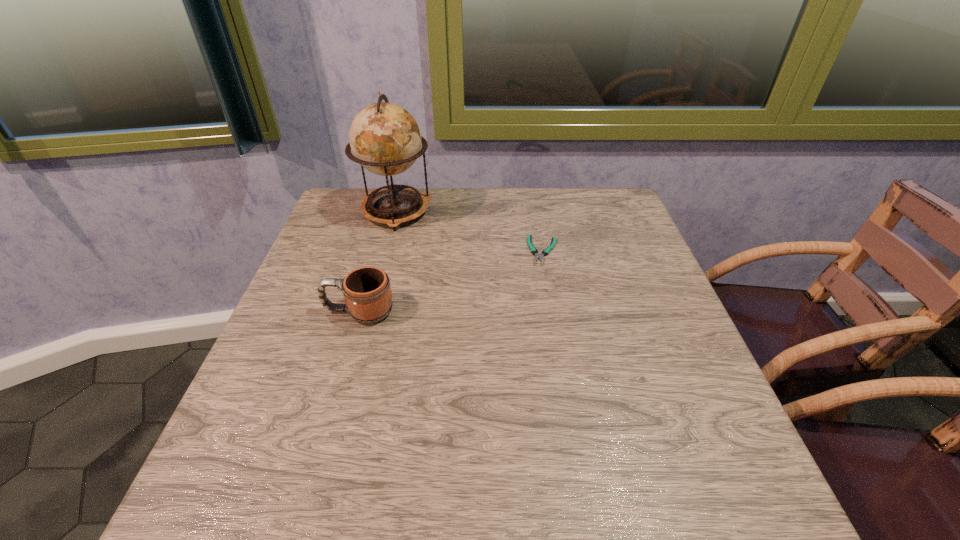
Find the location of a particular element. mug located in the left edge section of the desktop is located at coordinates (367, 292).

The image size is (960, 540). Identify the location of object that is at the far left corner. (385, 139).

Identify the location of free space at the far edge of the desktop. This screenshot has height=540, width=960. (396, 233).

In the image, there is a desktop. Identify the location of vacant space at the near edge. (397, 512).

Where is `free region at the left edge of the desktop`? free region at the left edge of the desktop is located at coordinates (301, 287).

The width and height of the screenshot is (960, 540). Find the location of `free space at the right edge`. free space at the right edge is located at coordinates (634, 355).

The height and width of the screenshot is (540, 960). Find the location of `free location at the near left corner`. free location at the near left corner is located at coordinates (309, 488).

Identify the location of free region at the far right corner of the desktop. (577, 200).

Find the location of a particular element. Image resolution: width=960 pixels, height=540 pixels. unoccupied area between the tallest object and the shortest object is located at coordinates (469, 231).

The image size is (960, 540). I want to click on vacant area that lies between the farthest object and the second shortest object, so click(377, 261).